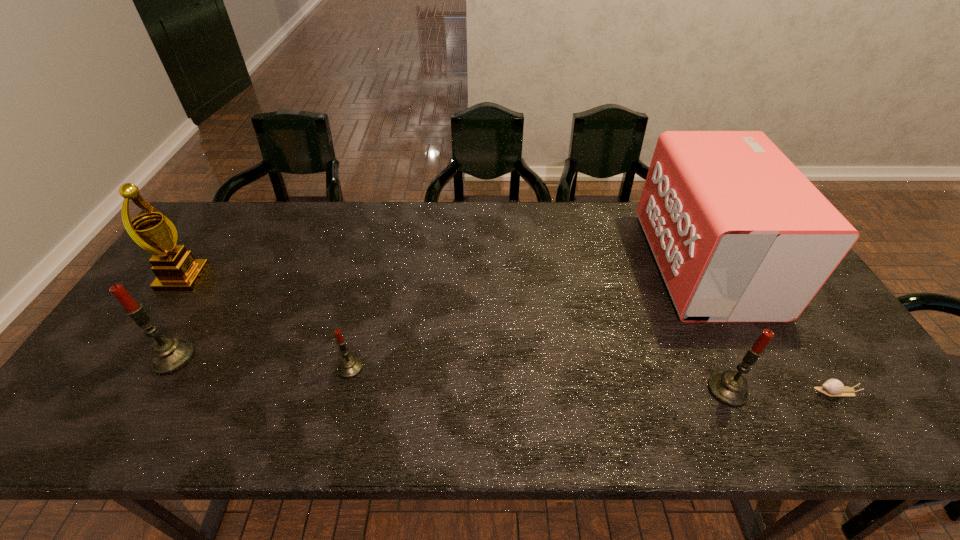
Find the location of a particular element. The height and width of the screenshot is (540, 960). free spot between the second candle from right to left and the leftmost candle is located at coordinates (262, 363).

Locate an element on the screen. vacant point located between the escargot and the award is located at coordinates (510, 335).

Locate an element on the screen. Image resolution: width=960 pixels, height=540 pixels. vacant area that lies between the leftmost candle and the second shortest candle is located at coordinates (450, 374).

Identify which object is located as the second nearest to the escargot. Please provide its 2D coordinates. Your answer should be formatted as a tuple, i.e. [(x, y)], where the tuple contains the x and y coordinates of a point satisfying the conditions above.

[(739, 234)]

Find the location of a particular element. The image size is (960, 540). object that can be found as the third closest to the leftmost candle is located at coordinates (739, 234).

Locate which candle ranks third in proximity to the award. Please provide its 2D coordinates. Your answer should be formatted as a tuple, i.e. [(x, y)], where the tuple contains the x and y coordinates of a point satisfying the conditions above.

[(729, 388)]

Image resolution: width=960 pixels, height=540 pixels. Identify the location of candle that stands as the closest to the shortest candle. pyautogui.click(x=168, y=354).

I want to click on vacant point that satisfies the following two spatial constraints: 1. on the front-facing side of the fifth tallest object; 2. on the right side of the award, so click(123, 368).

Find the location of a particular element. free location that satisfies the following two spatial constraints: 1. on the surface of the box where the text is embossed; 2. on the front side of the second candle from left to right is located at coordinates (760, 368).

Find the location of a particular element. The height and width of the screenshot is (540, 960). free space that satisfies the following two spatial constraints: 1. on the front-facing side of the award; 2. on the back side of the third shortest object is located at coordinates (108, 390).